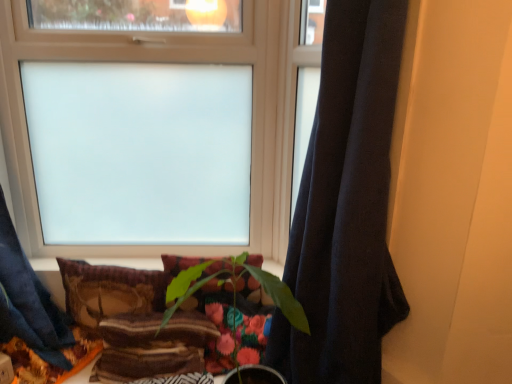
Question: From a real-world perspective, is dark blue fabric curtain at right positioned above or below velvet-like brown pillow at lower center, acting as the second pillow starting from the right?

Choices:
 (A) above
 (B) below

Answer: (A)

Question: Is dark blue fabric curtain at right taller or shorter than velvet-like brown pillow at lower center, acting as the second pillow starting from the right?

Choices:
 (A) short
 (B) tall

Answer: (B)

Question: Which object is positioned farthest from the velvet-like brown pillow at lower center, acting as the second pillow starting from the right?

Choices:
 (A) green matte plant at center
 (B) velvet textured pillow at center, which is the 2th pillow from left to right
 (C) frosted glass window at upper center
 (D) dark blue fabric curtain at right

Answer: (D)

Question: Considering the real-world distances, which object is closest to the green matte plant at center?

Choices:
 (A) velvet-like brown pillow at lower center, acting as the second pillow starting from the right
 (B) velvet textured pillow at center, which is the 2th pillow from left to right
 (C) frosted glass window at upper center
 (D) dark blue fabric curtain at right

Answer: (B)